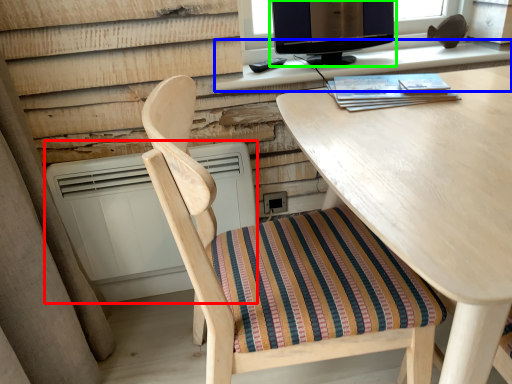
Question: Considering the real-world distances, which object is farthest from air conditioner (highlighted by a red box)? computer desk (highlighted by a blue box) or computer monitor (highlighted by a green box)?

Choices:
 (A) computer desk
 (B) computer monitor

Answer: (B)